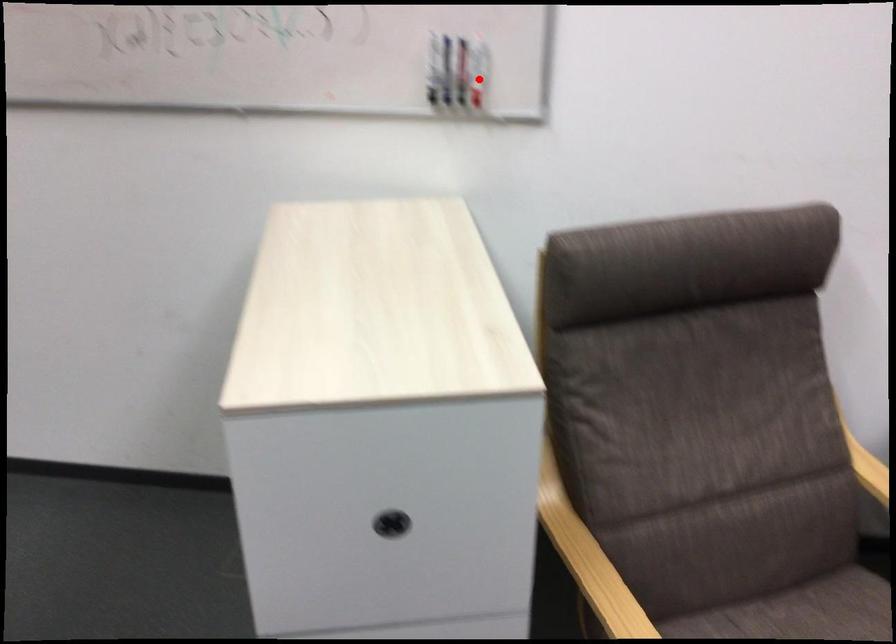
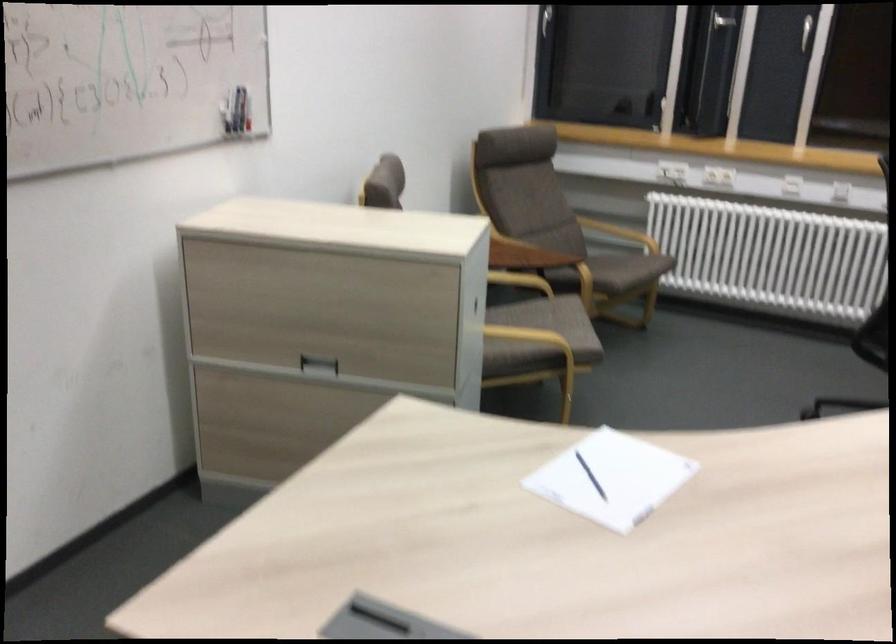
Locate, in the second image, the point that corresponds to the highlighted location in the first image.

(248, 114)